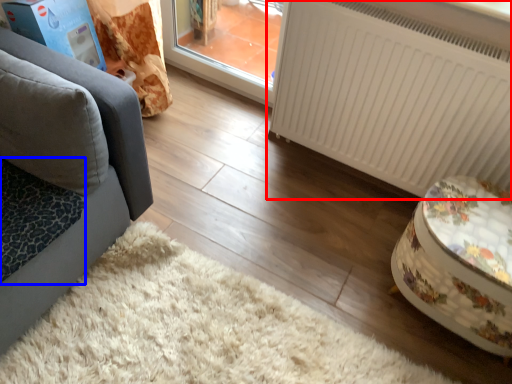
Question: Which point is closer to the camera, radiator (highlighted by a red box) or cat bed (highlighted by a blue box)?

Choices:
 (A) radiator
 (B) cat bed

Answer: (B)